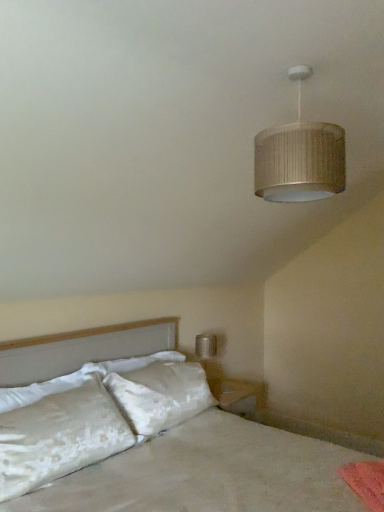
Describe the element at coordinates (59, 437) in the screenshot. Image resolution: width=384 pixels, height=512 pixels. I see `white velvety pillow at lower left, the 1th pillow in the bottom-to-top sequence` at that location.

Image resolution: width=384 pixels, height=512 pixels. Find the location of `matte silver lampshade at upper right`. matte silver lampshade at upper right is located at coordinates (299, 157).

Where is `pillow lying on the left of white velvety pillow at lower left, the 1th pillow in the bottom-to-top sequence`? The image size is (384, 512). pillow lying on the left of white velvety pillow at lower left, the 1th pillow in the bottom-to-top sequence is located at coordinates (48, 387).

From the image's perspective, is white velvety pillow at lower left, the 1th pillow in the bottom-to-top sequence, located above or below white soft pillow at left, the second pillow in the bottom-to-top sequence?

From the image's perspective, white velvety pillow at lower left, the 1th pillow in the bottom-to-top sequence, appears below white soft pillow at left, the second pillow in the bottom-to-top sequence.

Can you confirm if white velvety pillow at lower left, the 1th pillow in the bottom-to-top sequence, is smaller than white soft pillow at left, the second pillow in the bottom-to-top sequence?

Actually, white velvety pillow at lower left, the 1th pillow in the bottom-to-top sequence, might be larger than white soft pillow at left, the second pillow in the bottom-to-top sequence.

From the image's perspective, is matte silver lampshade at upper right above white velvety pillow at lower left, the 1th pillow in the bottom-to-top sequence?

Yes, from the image's perspective, matte silver lampshade at upper right is above white velvety pillow at lower left, the 1th pillow in the bottom-to-top sequence.

Does matte silver lampshade at upper right have a greater width compared to white velvety pillow at lower left, positioned as the second pillow in top-to-bottom order?

In fact, matte silver lampshade at upper right might be narrower than white velvety pillow at lower left, positioned as the second pillow in top-to-bottom order.

Identify the location of lamp that appears on the right of white soft pillow at left, the first pillow when ordered from top to bottom. This screenshot has height=512, width=384. (299, 157).

Which object is positioned more to the left, matte silver lampshade at upper right or white soft pillow at left, the first pillow when ordered from top to bottom?

white soft pillow at left, the first pillow when ordered from top to bottom.

From the image's perspective, does matte silver lampshade at upper right appear higher than white soft pillow at left, the second pillow in the bottom-to-top sequence?

Indeed, from the image's perspective, matte silver lampshade at upper right is shown above white soft pillow at left, the second pillow in the bottom-to-top sequence.

How different are the orientations of matte silver lampshade at upper right and white soft pillow at left, the second pillow in the bottom-to-top sequence, in degrees?

4.15 degrees.

Consider the image. From a real-world perspective, is white soft pillow at left, the second pillow in the bottom-to-top sequence, above or below white velvety pillow at lower left, the 1th pillow in the bottom-to-top sequence?

In terms of real-world spatial position, white soft pillow at left, the second pillow in the bottom-to-top sequence, is above white velvety pillow at lower left, the 1th pillow in the bottom-to-top sequence.

Considering the sizes of white soft pillow at left, the second pillow in the bottom-to-top sequence, and white velvety pillow at lower left, positioned as the second pillow in top-to-bottom order, in the image, is white soft pillow at left, the second pillow in the bottom-to-top sequence, bigger or smaller than white velvety pillow at lower left, positioned as the second pillow in top-to-bottom order,?

Clearly, white soft pillow at left, the second pillow in the bottom-to-top sequence, is smaller in size than white velvety pillow at lower left, positioned as the second pillow in top-to-bottom order.

Is white soft pillow at left, the second pillow in the bottom-to-top sequence, positioned beyond the bounds of white velvety pillow at lower left, positioned as the second pillow in top-to-bottom order?

white soft pillow at left, the second pillow in the bottom-to-top sequence, lies outside white velvety pillow at lower left, positioned as the second pillow in top-to-bottom order,'s area.

From a real-world perspective, is white soft pillow at left, the second pillow in the bottom-to-top sequence, positioned over matte silver lampshade at upper right based on gravity?

No.

From the image's perspective, between white soft pillow at left, the second pillow in the bottom-to-top sequence, and matte silver lampshade at upper right, which one is located above?

matte silver lampshade at upper right appears higher in the image.

Can you confirm if white soft pillow at left, the second pillow in the bottom-to-top sequence, is taller than matte silver lampshade at upper right?

Incorrect, the height of white soft pillow at left, the second pillow in the bottom-to-top sequence, is not larger of that of matte silver lampshade at upper right.

Considering the relative positions of white soft pillow at left, the second pillow in the bottom-to-top sequence, and matte silver lampshade at upper right in the image provided, is white soft pillow at left, the second pillow in the bottom-to-top sequence, in front of matte silver lampshade at upper right?

That is False.

From the image's perspective, which is above, matte silver lampshade at upper right or white satin bed at lower left?

matte silver lampshade at upper right, from the image's perspective.

Between point (339, 129) and point (62, 347), which one is positioned behind?

The point (62, 347) is more distant.

Is matte silver lampshade at upper right not inside white satin bed at lower left?

Indeed, matte silver lampshade at upper right is completely outside white satin bed at lower left.

Can you confirm if matte silver lampshade at upper right is shorter than white satin bed at lower left?

Correct, matte silver lampshade at upper right is not as tall as white satin bed at lower left.

From the image's perspective, which object appears higher, white satin bed at lower left or white soft pillow at left, the first pillow when ordered from top to bottom?

white soft pillow at left, the first pillow when ordered from top to bottom, from the image's perspective.

From a real-world perspective, between white satin bed at lower left and white soft pillow at left, the second pillow in the bottom-to-top sequence, who is vertically higher?

white soft pillow at left, the second pillow in the bottom-to-top sequence, from a real-world perspective.

Find the location of `bed below the white soft pillow at left, the second pillow in the bottom-to-top sequence (from the image's perspective)`. bed below the white soft pillow at left, the second pillow in the bottom-to-top sequence (from the image's perspective) is located at coordinates (209, 473).

Is white satin bed at lower left taller or shorter than white soft pillow at left, the first pillow when ordered from top to bottom?

white satin bed at lower left is taller than white soft pillow at left, the first pillow when ordered from top to bottom.

Locate an element on the screen. The image size is (384, 512). pillow above the white velvety pillow at lower left, positioned as the second pillow in top-to-bottom order (from the image's perspective) is located at coordinates (48, 387).

There is a white velvety pillow at lower left, the 1th pillow in the bottom-to-top sequence. Where is `lamp above it (from a real-world perspective)`? lamp above it (from a real-world perspective) is located at coordinates (299, 157).

From the image, which object appears to be nearer to white satin bed at lower left, white velvety pillow at lower left, the 1th pillow in the bottom-to-top sequence, or white soft pillow at left, the second pillow in the bottom-to-top sequence?

Among the two, white velvety pillow at lower left, the 1th pillow in the bottom-to-top sequence, is located nearer to white satin bed at lower left.

From the image, which object appears to be farther from white soft pillow at left, the first pillow when ordered from top to bottom, white velvety pillow at lower left, the 1th pillow in the bottom-to-top sequence, or white satin bed at lower left?

The object further to white soft pillow at left, the first pillow when ordered from top to bottom, is white satin bed at lower left.

When comparing their distances from white satin bed at lower left, does matte silver lampshade at upper right or white soft pillow at left, the first pillow when ordered from top to bottom, seem closer?

The object closer to white satin bed at lower left is white soft pillow at left, the first pillow when ordered from top to bottom.

Considering their positions, is white satin bed at lower left positioned closer to white soft pillow at left, the second pillow in the bottom-to-top sequence, than white velvety pillow at lower left, positioned as the second pillow in top-to-bottom order?

Based on the image, white velvety pillow at lower left, positioned as the second pillow in top-to-bottom order, appears to be nearer to white soft pillow at left, the second pillow in the bottom-to-top sequence.

Which object lies nearer to the anchor point white satin bed at lower left, white soft pillow at left, the second pillow in the bottom-to-top sequence, or matte silver lampshade at upper right?

white soft pillow at left, the second pillow in the bottom-to-top sequence, is positioned closer to the anchor white satin bed at lower left.

Estimate the real-world distances between objects in this image. Which object is further from white velvety pillow at lower left, the 1th pillow in the bottom-to-top sequence, matte silver lampshade at upper right or white satin bed at lower left?

matte silver lampshade at upper right lies further to white velvety pillow at lower left, the 1th pillow in the bottom-to-top sequence, than the other object.

Which object lies further to the anchor point white soft pillow at left, the second pillow in the bottom-to-top sequence, matte silver lampshade at upper right or white satin bed at lower left?

Among the two, matte silver lampshade at upper right is located further to white soft pillow at left, the second pillow in the bottom-to-top sequence.

Looking at the image, which one is located closer to white soft pillow at left, the first pillow when ordered from top to bottom, white velvety pillow at lower left, positioned as the second pillow in top-to-bottom order, or matte silver lampshade at upper right?

Among the two, white velvety pillow at lower left, positioned as the second pillow in top-to-bottom order, is located nearer to white soft pillow at left, the first pillow when ordered from top to bottom.

At what (x,y) coordinates should I click in order to perform the action: click on pillow between matte silver lampshade at upper right and white velvety pillow at lower left, positioned as the second pillow in top-to-bottom order, vertically. Please return your answer as a coordinate pair (x, y). This screenshot has height=512, width=384. Looking at the image, I should click on (48, 387).

Where is `pillow between white satin bed at lower left and white soft pillow at left, the second pillow in the bottom-to-top sequence, along the z-axis`? The height and width of the screenshot is (512, 384). pillow between white satin bed at lower left and white soft pillow at left, the second pillow in the bottom-to-top sequence, along the z-axis is located at coordinates (59, 437).